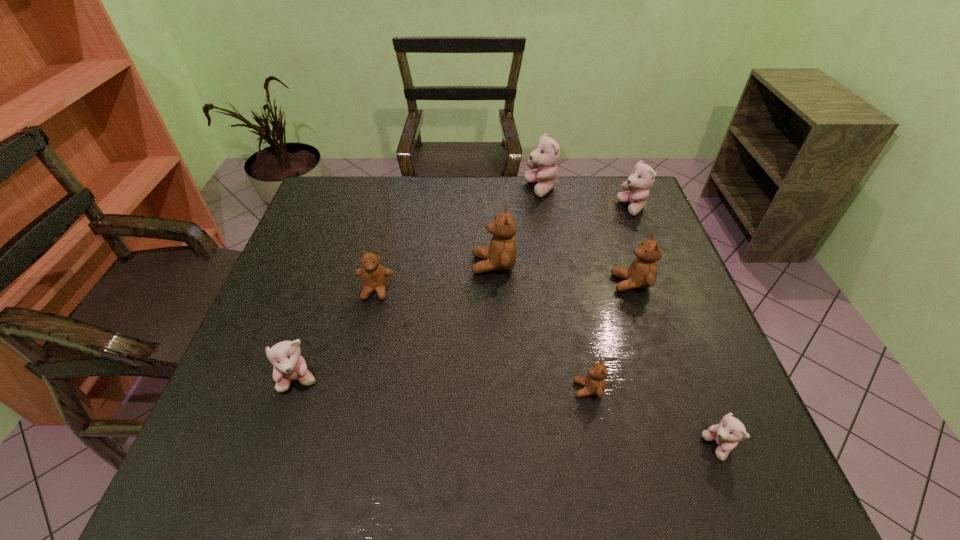
The height and width of the screenshot is (540, 960). I want to click on vacant space at the right edge, so click(646, 232).

In the image, there is a desktop. At what (x,y) coordinates should I click in order to perform the action: click on free region at the far left corner. Please return your answer as a coordinate pair (x, y). This screenshot has width=960, height=540. Looking at the image, I should click on (336, 186).

You are a GUI agent. You are given a task and a screenshot of the screen. Output one action in this format:
    pyautogui.click(x=<x>, y=<y>)
    Task: Click on the free region at the near right corner of the desktop
    The height and width of the screenshot is (540, 960).
    Given the screenshot: What is the action you would take?
    pyautogui.click(x=748, y=454)

Locate an element on the screen. free spot between the rightmost brown teddy bear and the smallest brown teddy bear is located at coordinates [x=610, y=336].

I want to click on free space between the leftmost brown teddy bear and the second nearest pink teddy bear, so click(x=337, y=336).

This screenshot has width=960, height=540. I want to click on free spot between the nearest teddy bear and the second smallest pink teddy bear, so click(509, 414).

In order to click on free space between the third teddy bear from left to right and the third smallest pink teddy bear in this screenshot , I will do `click(563, 236)`.

In order to click on vacant area that lies between the biggest pink teddy bear and the nearest object in this screenshot , I will do `click(630, 319)`.

You are a GUI agent. You are given a task and a screenshot of the screen. Output one action in this format:
    pyautogui.click(x=<x>, y=<y>)
    Task: Click on the free area in between the second teddy bear from left to right and the leftmost teddy bear
    The height and width of the screenshot is (540, 960).
    Given the screenshot: What is the action you would take?
    pyautogui.click(x=337, y=336)

At what (x,y) coordinates should I click in order to perform the action: click on unoccupied area between the sixth teddy bear from right to left and the seventh object from right to left. Please return your answer as a coordinate pair (x, y). Looking at the image, I should click on (435, 278).